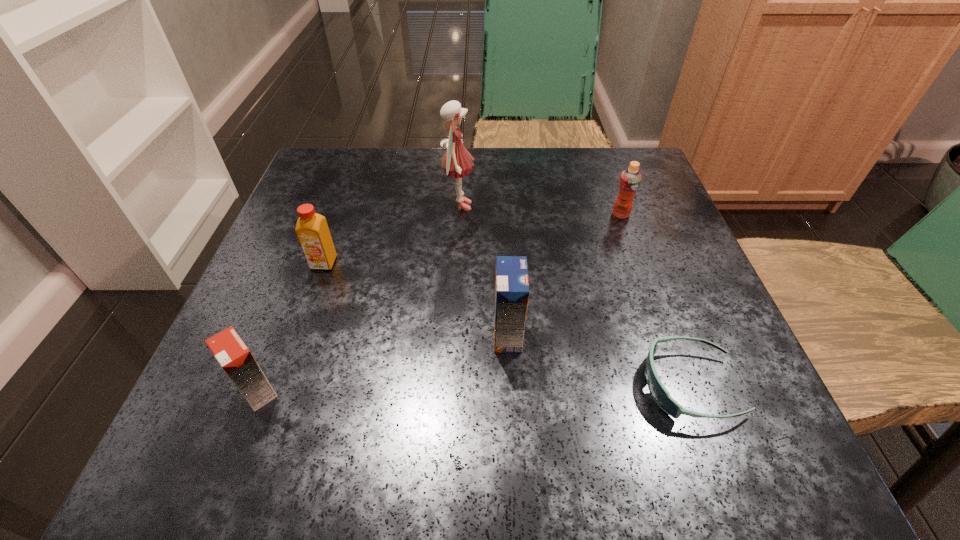
Where is `empty location between the second nearest orange juice and the second farthest orange juice`? The width and height of the screenshot is (960, 540). empty location between the second nearest orange juice and the second farthest orange juice is located at coordinates (416, 299).

Locate an element on the screen. unoccupied area between the farthest orange juice and the nearest orange juice is located at coordinates (440, 303).

Locate which object ranks third in proximity to the second orange juice from right to left. Please provide its 2D coordinates. Your answer should be formatted as a tuple, i.e. [(x, y)], where the tuple contains the x and y coordinates of a point satisfying the conditions above.

[(312, 230)]

Image resolution: width=960 pixels, height=540 pixels. I want to click on object that is the fifth closest to the shortest object, so pos(312,230).

The image size is (960, 540). I want to click on orange juice that stands as the closest to the third object from right to left, so click(312, 230).

This screenshot has height=540, width=960. I want to click on the third closest orange juice to the goggles, so click(x=230, y=351).

At what (x,y) coordinates should I click in order to perform the action: click on free spot that satisfies the following two spatial constraints: 1. on the back side of the third farthest orange juice; 2. on the front-facing side of the tallest object. Please return your answer as a coordinate pair (x, y). This screenshot has height=540, width=960. Looking at the image, I should click on (501, 206).

The width and height of the screenshot is (960, 540). Identify the location of blank space that satisfies the following two spatial constraints: 1. on the front-facing side of the farthest orange juice; 2. on the right side of the tallest object. (458, 214).

You are a GUI agent. You are given a task and a screenshot of the screen. Output one action in this format:
    pyautogui.click(x=<x>, y=<y>)
    Task: Click on the free space in the image that satisfies the following two spatial constraints: 1. on the front-facing side of the tallest object; 2. on the front and back of the third nearest orange juice
    
    Given the screenshot: What is the action you would take?
    pyautogui.click(x=456, y=263)

Find the location of a particular element. The image size is (960, 540). free space that satisfies the following two spatial constraints: 1. on the back side of the rightmost orange juice; 2. on the front-facing side of the tallest object is located at coordinates (618, 206).